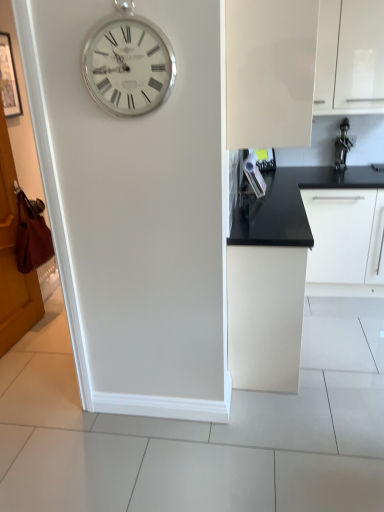
The image size is (384, 512). What do you see at coordinates (128, 66) in the screenshot? I see `silver metallic clock at upper left` at bounding box center [128, 66].

At what (x,y) coordinates should I click in order to perform the action: click on metallic silver figurine at upper right. Please return your answer as a coordinate pair (x, y). This screenshot has width=384, height=512. Looking at the image, I should click on (342, 146).

Locate an element on the screen. matte white cabinet at center, which appears as the 1th cabinetry when ordered from the bottom is located at coordinates (265, 316).

This screenshot has width=384, height=512. Identify the location of white glossy cabinet at upper right, the third cabinetry from the bottom. (350, 56).

Where is `silver metallic clock at upper left`? silver metallic clock at upper left is located at coordinates (128, 66).

Does point (333, 78) lie in front of point (320, 44)?

No.

Measure the distance between white glossy cabinet at upper right, the third cabinetry from the bottom, and glossy white cabinet at upper right, acting as the second cabinetry starting from the bottom.

A distance of 1.25 meters exists between white glossy cabinet at upper right, the third cabinetry from the bottom, and glossy white cabinet at upper right, acting as the second cabinetry starting from the bottom.

Would you say glossy white cabinet at upper right, which ranks as the 2th cabinetry in top-to-bottom order, is part of white glossy cabinet at upper right, the third cabinetry from the bottom,'s contents?

Definitely not — glossy white cabinet at upper right, which ranks as the 2th cabinetry in top-to-bottom order, is not inside white glossy cabinet at upper right, the third cabinetry from the bottom.

Can you tell me how much white glossy cabinet at upper right, the third cabinetry from the bottom, and glossy white cabinet at upper right, acting as the second cabinetry starting from the bottom, differ in facing direction?

The angular difference between white glossy cabinet at upper right, the third cabinetry from the bottom, and glossy white cabinet at upper right, acting as the second cabinetry starting from the bottom, is 89.9 degrees.

Is brown wooden door at left beside white glossy cabinet at upper right, which is the first cabinetry in top-to-bottom order?

No, brown wooden door at left is not in contact with white glossy cabinet at upper right, which is the first cabinetry in top-to-bottom order.

Could you tell me if brown wooden door at left is facing white glossy cabinet at upper right, which is the first cabinetry in top-to-bottom order?

No, brown wooden door at left is not oriented towards white glossy cabinet at upper right, which is the first cabinetry in top-to-bottom order.

Looking at this image, is brown wooden door at left taller or shorter than white glossy cabinet at upper right, which is the first cabinetry in top-to-bottom order?

Considering their sizes, brown wooden door at left has more height than white glossy cabinet at upper right, which is the first cabinetry in top-to-bottom order.

Which is more distant, [18,295] or [323,34]?

Point [18,295]

Considering the sizes of metallic silver figurine at upper right and white glossy cabinet at upper right, the third cabinetry from the bottom, in the image, is metallic silver figurine at upper right bigger or smaller than white glossy cabinet at upper right, the third cabinetry from the bottom,?

metallic silver figurine at upper right is smaller than white glossy cabinet at upper right, the third cabinetry from the bottom.

Is there a large distance between metallic silver figurine at upper right and white glossy cabinet at upper right, which is the first cabinetry in top-to-bottom order?

Actually, metallic silver figurine at upper right and white glossy cabinet at upper right, which is the first cabinetry in top-to-bottom order, are a little close together.

Between metallic silver figurine at upper right and white glossy cabinet at upper right, which is the first cabinetry in top-to-bottom order, which one is positioned behind?

metallic silver figurine at upper right.

The image size is (384, 512). I want to click on the 1st cabinetry to the left of the metallic silver figurine at upper right, counting from the anchor's position, so click(x=350, y=56).

Is glossy white cabinet at upper right, which ranks as the 2th cabinetry in top-to-bottom order, far away from matte white cabinet at center, which appears as the 1th cabinetry when ordered from the bottom?

They are positioned close to each other.

Measure the distance between glossy white cabinet at upper right, acting as the second cabinetry starting from the bottom, and matte white cabinet at center, the third cabinetry from the top.

The distance of glossy white cabinet at upper right, acting as the second cabinetry starting from the bottom, from matte white cabinet at center, the third cabinetry from the top, is 33.76 inches.

Based on the photo, could you tell me if glossy white cabinet at upper right, which ranks as the 2th cabinetry in top-to-bottom order, is turned towards matte white cabinet at center, which appears as the 1th cabinetry when ordered from the bottom?

A: No, glossy white cabinet at upper right, which ranks as the 2th cabinetry in top-to-bottom order, is not facing towards matte white cabinet at center, which appears as the 1th cabinetry when ordered from the bottom.

Between glossy white cabinet at upper right, acting as the second cabinetry starting from the bottom, and matte white cabinet at center, which appears as the 1th cabinetry when ordered from the bottom, which one has larger size?

matte white cabinet at center, which appears as the 1th cabinetry when ordered from the bottom, is bigger.

Visually, is silver metallic clock at upper left positioned to the left or to the right of glossy white cabinet at upper right, which ranks as the 2th cabinetry in top-to-bottom order?

Based on their positions, silver metallic clock at upper left is located to the left of glossy white cabinet at upper right, which ranks as the 2th cabinetry in top-to-bottom order.

Considering the relative sizes of silver metallic clock at upper left and glossy white cabinet at upper right, acting as the second cabinetry starting from the bottom, in the image provided, is silver metallic clock at upper left bigger than glossy white cabinet at upper right, acting as the second cabinetry starting from the bottom,?

No.

Could you tell me if silver metallic clock at upper left is facing glossy white cabinet at upper right, which ranks as the 2th cabinetry in top-to-bottom order?

No, silver metallic clock at upper left is not turned towards glossy white cabinet at upper right, which ranks as the 2th cabinetry in top-to-bottom order.

Consider the image. Are silver metallic clock at upper left and glossy white cabinet at upper right, acting as the second cabinetry starting from the bottom, located far from each other?

silver metallic clock at upper left is near glossy white cabinet at upper right, acting as the second cabinetry starting from the bottom, not far away.

Is the depth of silver metallic clock at upper left less than that of white glossy cabinet at upper right, which is the first cabinetry in top-to-bottom order?

Yes, it is in front of white glossy cabinet at upper right, which is the first cabinetry in top-to-bottom order.

Is silver metallic clock at upper left not inside white glossy cabinet at upper right, the third cabinetry from the bottom?

silver metallic clock at upper left is positioned outside white glossy cabinet at upper right, the third cabinetry from the bottom.

Are silver metallic clock at upper left and white glossy cabinet at upper right, the third cabinetry from the bottom, beside each other?

No, silver metallic clock at upper left is not in contact with white glossy cabinet at upper right, the third cabinetry from the bottom.

Identify the location of wall clock to the left of glossy white cabinet at upper right, which ranks as the 2th cabinetry in top-to-bottom order. The width and height of the screenshot is (384, 512). (128, 66).

From a real-world perspective, between glossy white cabinet at upper right, acting as the second cabinetry starting from the bottom, and silver metallic clock at upper left, who is vertically higher?

glossy white cabinet at upper right, acting as the second cabinetry starting from the bottom, is physically above.

From the picture: Is glossy white cabinet at upper right, which ranks as the 2th cabinetry in top-to-bottom order, oriented towards silver metallic clock at upper left?

No, glossy white cabinet at upper right, which ranks as the 2th cabinetry in top-to-bottom order, is not turned towards silver metallic clock at upper left.

This screenshot has height=512, width=384. Identify the location of cabinetry above the glossy white cabinet at upper right, acting as the second cabinetry starting from the bottom (from the image's perspective). (350, 56).

You are a GUI agent. You are given a task and a screenshot of the screen. Output one action in this format:
    pyautogui.click(x=<x>, y=<y>)
    Task: Click on the 1st cabinetry located above the brown wooden door at left (from a real-world perspective)
    This screenshot has width=384, height=512.
    Given the screenshot: What is the action you would take?
    pyautogui.click(x=350, y=56)

Based on their spatial positions, is matte white cabinet at center, the third cabinetry from the top, or silver metallic clock at upper left closer to metallic silver figurine at upper right?

matte white cabinet at center, the third cabinetry from the top, is positioned closer to the anchor metallic silver figurine at upper right.

When comparing their distances from silver metallic clock at upper left, does matte white cabinet at center, the third cabinetry from the top, or glossy white cabinet at upper right, which ranks as the 2th cabinetry in top-to-bottom order, seem further?

Among the two, matte white cabinet at center, the third cabinetry from the top, is located further to silver metallic clock at upper left.

From the image, which object appears to be nearer to glossy white cabinet at upper right, which ranks as the 2th cabinetry in top-to-bottom order, silver metallic clock at upper left or brown wooden door at left?

silver metallic clock at upper left.

Which object lies nearer to the anchor point glossy white cabinet at upper right, which ranks as the 2th cabinetry in top-to-bottom order, white glossy cabinet at upper right, the third cabinetry from the bottom, or brown wooden door at left?

white glossy cabinet at upper right, the third cabinetry from the bottom, is closer to glossy white cabinet at upper right, which ranks as the 2th cabinetry in top-to-bottom order.

Considering their positions, is silver metallic clock at upper left positioned further to matte white cabinet at center, the third cabinetry from the top, than brown wooden door at left?

Based on the image, brown wooden door at left appears to be further to matte white cabinet at center, the third cabinetry from the top.

Considering their positions, is matte white cabinet at center, which appears as the 1th cabinetry when ordered from the bottom, positioned closer to white glossy cabinet at upper right, the third cabinetry from the bottom, than brown wooden door at left?

matte white cabinet at center, which appears as the 1th cabinetry when ordered from the bottom, is positioned closer to the anchor white glossy cabinet at upper right, the third cabinetry from the bottom.

From the image, which object appears to be farther from brown wooden door at left, silver metallic clock at upper left or metallic silver figurine at upper right?

metallic silver figurine at upper right.

Considering their positions, is metallic silver figurine at upper right positioned further to matte white cabinet at center, which appears as the 1th cabinetry when ordered from the bottom, than silver metallic clock at upper left?

metallic silver figurine at upper right lies further to matte white cabinet at center, which appears as the 1th cabinetry when ordered from the bottom, than the other object.

Where is `wall clock situated between brown wooden door at left and matte white cabinet at center, the third cabinetry from the top, from left to right`? This screenshot has width=384, height=512. wall clock situated between brown wooden door at left and matte white cabinet at center, the third cabinetry from the top, from left to right is located at coordinates (128, 66).

At what (x,y) coordinates should I click in order to perform the action: click on cabinetry situated between brown wooden door at left and matte white cabinet at center, the third cabinetry from the top, from left to right. Please return your answer as a coordinate pair (x, y). Looking at the image, I should click on (280, 70).

I want to click on wall clock between white glossy cabinet at upper right, the third cabinetry from the bottom, and matte white cabinet at center, the third cabinetry from the top, vertically, so click(x=128, y=66).

The image size is (384, 512). I want to click on wall clock between glossy white cabinet at upper right, which ranks as the 2th cabinetry in top-to-bottom order, and matte white cabinet at center, the third cabinetry from the top, vertically, so click(128, 66).